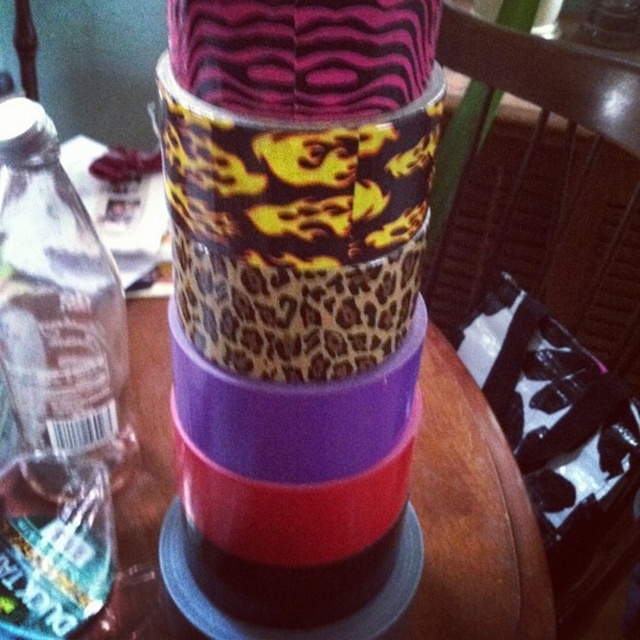
Question: Estimate the real-world distances between objects in this image. Which object is closer to the leopard print tape at center?

Choices:
 (A) purple matte plastic table at center
 (B) clear plastic bottle at left

Answer: (A)

Question: Which point appears closest to the camera in this image?

Choices:
 (A) click(227, 618)
 (B) click(468, 464)

Answer: (A)

Question: In this image, where is purple matte plastic table at center located relative to clear plastic bottle at left?

Choices:
 (A) right
 (B) left

Answer: (A)

Question: Estimate the real-world distances between objects in this image. Which object is farther from the leopard print tape at center?

Choices:
 (A) purple matte plastic table at center
 (B) clear plastic bottle at left

Answer: (B)

Question: Can you confirm if purple matte plastic table at center is positioned below clear plastic bottle at left?

Choices:
 (A) no
 (B) yes

Answer: (B)

Question: Is purple matte plastic table at center closer to the viewer compared to clear plastic bottle at left?

Choices:
 (A) yes
 (B) no

Answer: (B)